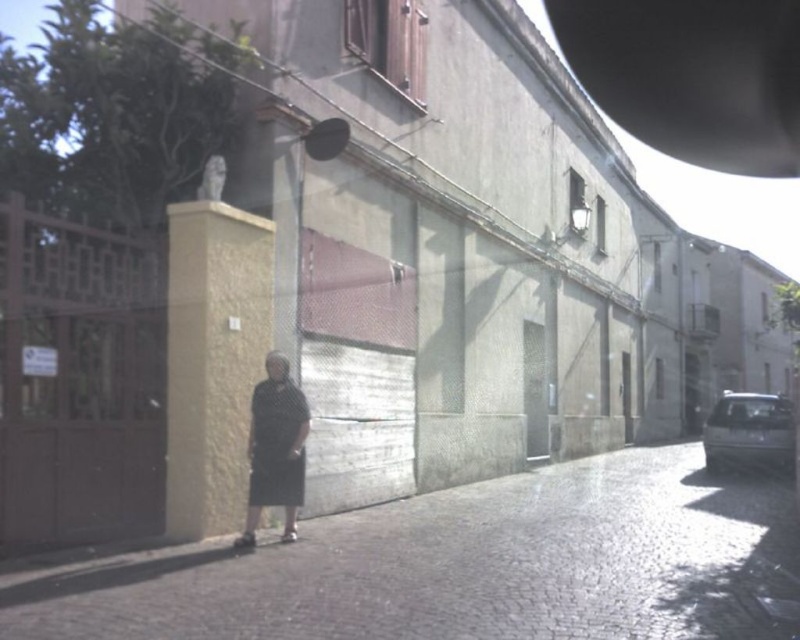
Question: Does dark gray cobblestone pavement at center appear on the right side of black matte dress at lower center?

Choices:
 (A) yes
 (B) no

Answer: (A)

Question: Which object appears farthest from the camera in this image?

Choices:
 (A) black matte dress at lower center
 (B) dark gray cobblestone pavement at center

Answer: (A)

Question: Which point is farther to the camera?

Choices:
 (A) dark gray cobblestone pavement at center
 (B) black matte dress at lower center

Answer: (B)

Question: Is the position of dark gray cobblestone pavement at center less distant than that of black matte dress at lower center?

Choices:
 (A) no
 (B) yes

Answer: (B)

Question: Which point is closer to the camera?

Choices:
 (A) (282, 381)
 (B) (216, 544)

Answer: (B)

Question: Is dark gray cobblestone pavement at center wider than black matte dress at lower center?

Choices:
 (A) no
 (B) yes

Answer: (B)